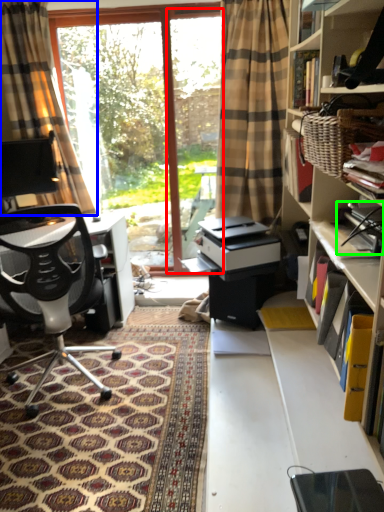
Question: Estimate the real-world distances between objects in this image. Which object is closer to screen door (highlighted by a red box), curtain (highlighted by a blue box) or book (highlighted by a green box)?

Choices:
 (A) curtain
 (B) book

Answer: (A)